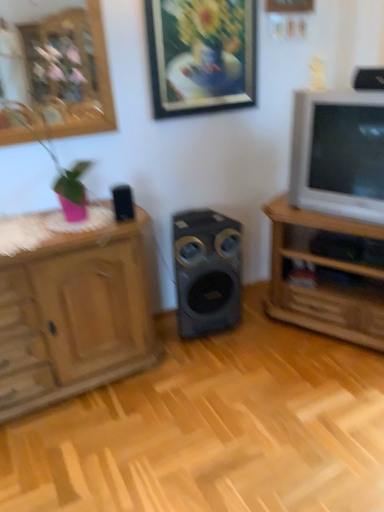
Question: From the image's perspective, relative to black plastic speaker at upper right, which is the third speaker from left to right, is matte black speaker at center, the 1th speaker ordered from the bottom, above or below?

Choices:
 (A) below
 (B) above

Answer: (A)

Question: Is matte black speaker at center, the 3th speaker positioned from the top, in front of or behind black plastic speaker at upper right, marked as the third speaker in a back-to-front arrangement, in the image?

Choices:
 (A) behind
 (B) front

Answer: (A)

Question: Estimate the real-world distances between objects in this image. Which object is closer to the wooden cabinet at left?

Choices:
 (A) matte black speaker at center, which ranks as the 1th speaker in back-to-front order
 (B) matte gray television at right
 (C) metallic gold picture frame at upper center
 (D) wooden tv stand at right
 (E) black plastic speaker at upper right, marked as the first speaker in a top-to-bottom arrangement

Answer: (A)

Question: Based on their relative distances, which object is farther from the wooden cabinet at left?

Choices:
 (A) metallic gold picture frame at upper center
 (B) black plastic speaker at upper left, acting as the 2th speaker starting from the front
 (C) matte black speaker at center, acting as the second speaker starting from the right
 (D) black plastic speaker at upper right, which is the third speaker from left to right
 (E) wooden tv stand at right

Answer: (D)